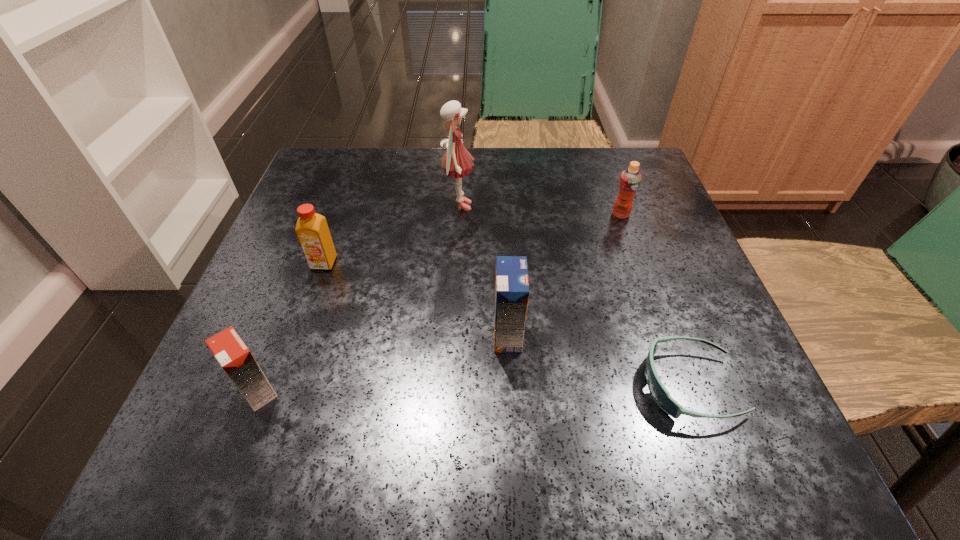
Image resolution: width=960 pixels, height=540 pixels. I want to click on free location located 0.050m on the front and back of the third farthest object, so click(x=313, y=293).

At what (x,y) coordinates should I click in order to perform the action: click on free point located on the left of the rightmost orange juice. Please return your answer as a coordinate pair (x, y). Image resolution: width=960 pixels, height=540 pixels. Looking at the image, I should click on (522, 214).

Locate an element on the screen. free region located 0.270m on the right of the nearest orange juice is located at coordinates (474, 392).

Where is `vacant space located on the front-facing side of the shortest object`? The height and width of the screenshot is (540, 960). vacant space located on the front-facing side of the shortest object is located at coordinates (420, 385).

This screenshot has height=540, width=960. In order to click on free space located on the front-facing side of the shortest object in this screenshot , I will do `click(371, 385)`.

The width and height of the screenshot is (960, 540). Identify the location of vacant region located on the front-facing side of the shortest object. (514, 385).

I want to click on doll located at the far edge, so click(456, 162).

Where is `orange juice present at the far edge`? This screenshot has width=960, height=540. orange juice present at the far edge is located at coordinates (630, 179).

Find the location of `orange juice that is at the near edge`. orange juice that is at the near edge is located at coordinates (230, 351).

This screenshot has width=960, height=540. What are the coordinates of `goggles located at the near edge` in the screenshot? It's located at (659, 393).